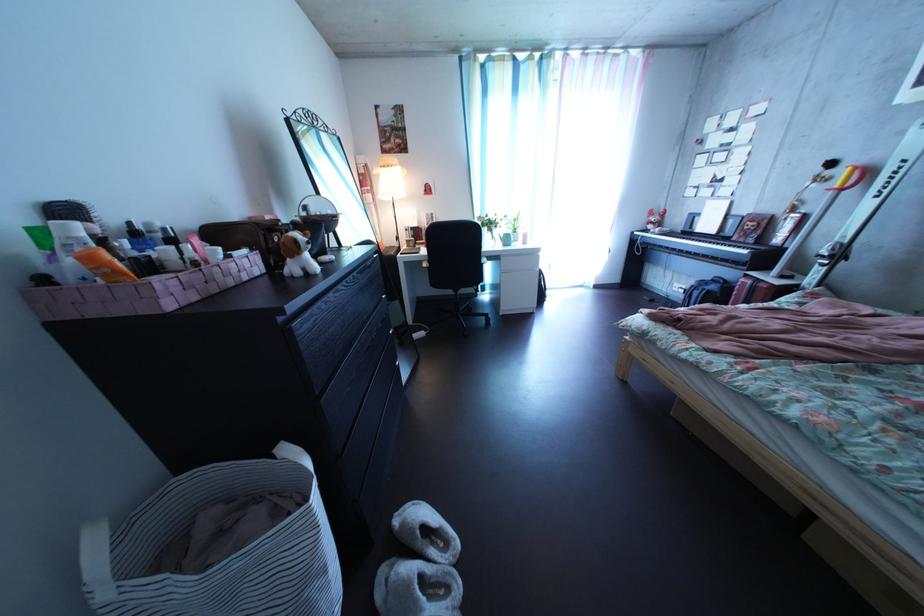
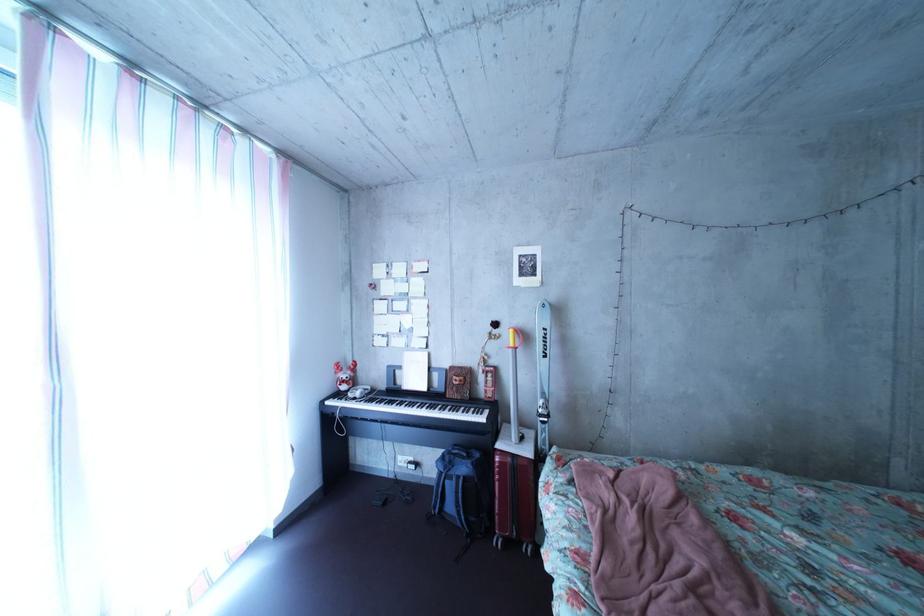
Locate, in the second image, the point that corresponds to point (664, 235) in the first image.

(358, 395)